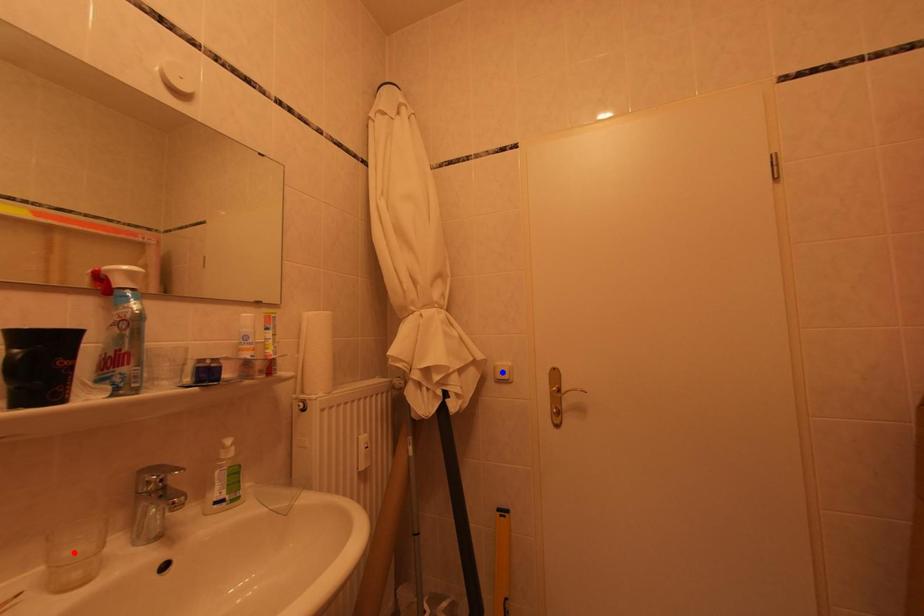
Question: In the image, two points are highlighted. Which point is nearer to the camera? Reply with the corresponding letter.

Choices:
 (A) blue point
 (B) red point

Answer: (B)